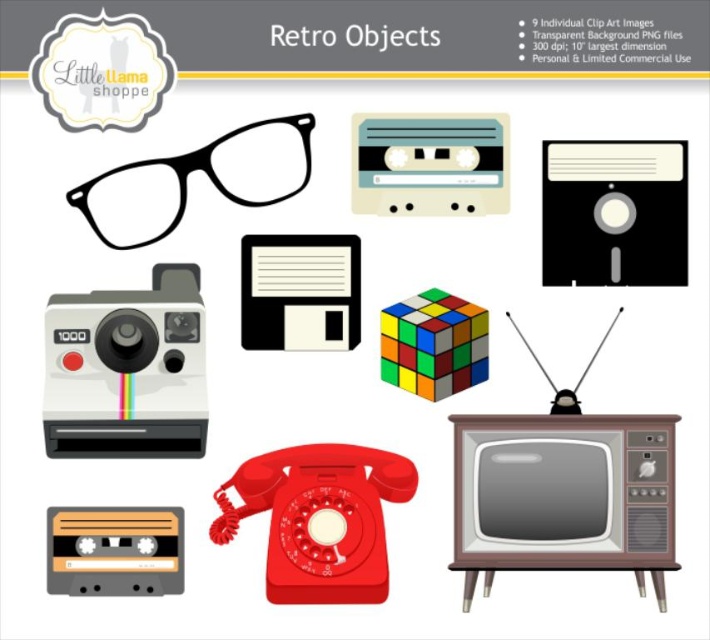
You are designing a poster and need to arrange the black matte glasses at upper left and the orange matte cassette at center. According to the image, which object is positioned higher on the poster?

The black matte glasses at upper left is located above the orange matte cassette at center, so it is positioned higher on the poster.

Consider the image. You are designing a poster and need to arrange the black plastic floppy disk at upper right and the beige matte cassette at center. Which object should you place higher on the poster to maintain their original vertical positions?

The black plastic floppy disk at upper right should be placed higher on the poster since it has a greater height compared to the beige matte cassette at center, maintaining their original vertical positions.